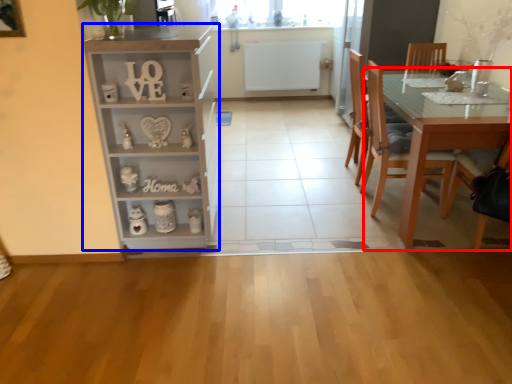
Question: Which object appears closest to the camera in this image, table (highlighted by a red box) or cabinetry (highlighted by a blue box)?

Choices:
 (A) table
 (B) cabinetry

Answer: (B)